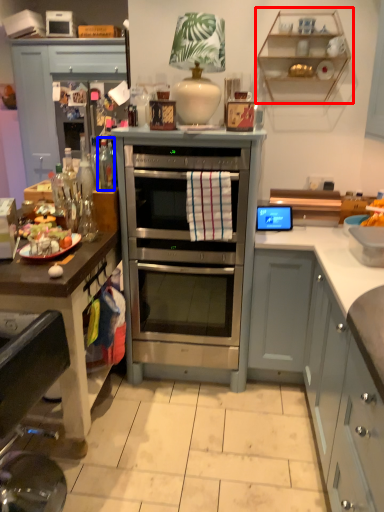
Question: Which object appears closest to the camera in this image, shelf (highlighted by a red box) or bottle (highlighted by a blue box)?

Choices:
 (A) shelf
 (B) bottle

Answer: (B)